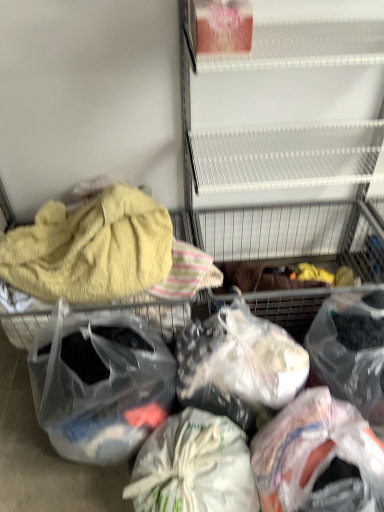
Question: Is translucent plastic bag at lower right, positioned as the 5th plastic bag in left-to-right order, taller than translucent plastic bag at center, the 3th plastic bag from the right?

Choices:
 (A) yes
 (B) no

Answer: (A)

Question: Can you confirm if translucent plastic bag at lower right, positioned as the 5th plastic bag in left-to-right order, is bigger than translucent plastic bag at center, acting as the 3th plastic bag starting from the left?

Choices:
 (A) no
 (B) yes

Answer: (B)

Question: Is translucent plastic bag at lower right, positioned as the 5th plastic bag in left-to-right order, shorter than translucent plastic bag at center, acting as the 3th plastic bag starting from the left?

Choices:
 (A) no
 (B) yes

Answer: (A)

Question: Is translucent plastic bag at center, acting as the 3th plastic bag starting from the left, located within translucent plastic bag at lower right, positioned as the 5th plastic bag in left-to-right order?

Choices:
 (A) yes
 (B) no

Answer: (B)

Question: Can you confirm if translucent plastic bag at lower right, positioned as the 5th plastic bag in left-to-right order, is wider than translucent plastic bag at center, acting as the 3th plastic bag starting from the left?

Choices:
 (A) yes
 (B) no

Answer: (A)

Question: Based on their sizes in the image, would you say translucent plastic bag at lower right, the fourth plastic bag from the left, is bigger or smaller than transparent plastic bag at center, acting as the 5th plastic bag starting from the right?

Choices:
 (A) big
 (B) small

Answer: (B)

Question: Is translucent plastic bag at lower right, which is the 2th plastic bag from right to left, to the left or to the right of transparent plastic bag at center, the first plastic bag when ordered from left to right, in the image?

Choices:
 (A) left
 (B) right

Answer: (B)

Question: Looking at their shapes, would you say translucent plastic bag at lower right, which is the 2th plastic bag from right to left, is wider or thinner than transparent plastic bag at center, the first plastic bag when ordered from left to right?

Choices:
 (A) thin
 (B) wide

Answer: (B)

Question: Is point (271, 457) closer or farther from the camera than point (51, 330)?

Choices:
 (A) closer
 (B) farther

Answer: (A)

Question: From their relative heights in the image, would you say translucent plastic bag at lower right, the fourth plastic bag from the left, is taller or shorter than white fabric bag at center, which is the second plastic bag in left-to-right order?

Choices:
 (A) short
 (B) tall

Answer: (B)

Question: Is point (256, 435) positioned closer to the camera than point (226, 484)?

Choices:
 (A) farther
 (B) closer

Answer: (A)

Question: Based on their sizes in the image, would you say translucent plastic bag at lower right, the fourth plastic bag from the left, is bigger or smaller than white fabric bag at center, acting as the 4th plastic bag starting from the right?

Choices:
 (A) small
 (B) big

Answer: (B)

Question: Do you think translucent plastic bag at lower right, the fourth plastic bag from the left, is within white fabric bag at center, which is the second plastic bag in left-to-right order, or outside of it?

Choices:
 (A) outside
 (B) inside

Answer: (A)

Question: Considering the positions of white fabric bag at center, acting as the 4th plastic bag starting from the right, and translucent plastic bag at center, acting as the 3th plastic bag starting from the left, in the image, is white fabric bag at center, acting as the 4th plastic bag starting from the right, taller or shorter than translucent plastic bag at center, acting as the 3th plastic bag starting from the left,?

Choices:
 (A) short
 (B) tall

Answer: (B)

Question: Which is correct: white fabric bag at center, acting as the 4th plastic bag starting from the right, is inside translucent plastic bag at center, acting as the 3th plastic bag starting from the left, or outside of it?

Choices:
 (A) outside
 (B) inside

Answer: (A)